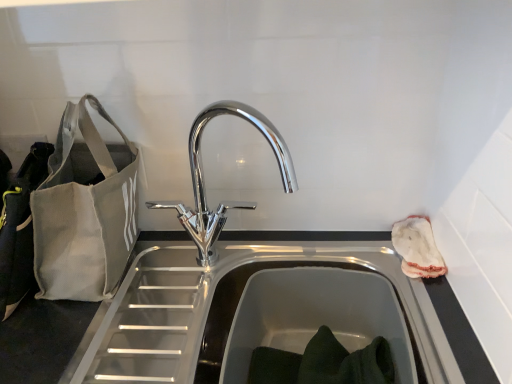
Question: Is chrome metallic faucet at center aimed at white fabric pouch at right?

Choices:
 (A) no
 (B) yes

Answer: (A)

Question: Is chrome metallic faucet at center thinner than white fabric pouch at right?

Choices:
 (A) yes
 (B) no

Answer: (B)

Question: Is chrome metallic faucet at center not near white fabric pouch at right?

Choices:
 (A) no
 (B) yes

Answer: (A)

Question: Is chrome metallic faucet at center to the right of white fabric pouch at right from the viewer's perspective?

Choices:
 (A) no
 (B) yes

Answer: (A)

Question: Is the surface of chrome metallic faucet at center in direct contact with white fabric pouch at right?

Choices:
 (A) yes
 (B) no

Answer: (B)

Question: From the image's perspective, is gray canvas bag at left positioned above or below chrome metallic faucet at center?

Choices:
 (A) below
 (B) above

Answer: (B)

Question: In the image, is gray canvas bag at left positioned in front of or behind chrome metallic faucet at center?

Choices:
 (A) front
 (B) behind

Answer: (A)

Question: In terms of width, does gray canvas bag at left look wider or thinner when compared to chrome metallic faucet at center?

Choices:
 (A) wide
 (B) thin

Answer: (A)

Question: Is gray canvas bag at left bigger or smaller than chrome metallic faucet at center?

Choices:
 (A) big
 (B) small

Answer: (A)

Question: Is point (437, 276) positioned closer to the camera than point (104, 246)?

Choices:
 (A) closer
 (B) farther

Answer: (B)

Question: Do you think white fabric pouch at right is within gray canvas bag at left, or outside of it?

Choices:
 (A) outside
 (B) inside

Answer: (A)

Question: From a real-world perspective, is white fabric pouch at right positioned above or below gray canvas bag at left?

Choices:
 (A) above
 (B) below

Answer: (B)

Question: Is white fabric pouch at right wider or thinner than gray canvas bag at left?

Choices:
 (A) thin
 (B) wide

Answer: (A)

Question: From a real-world perspective, is chrome metallic faucet at center positioned above or below gray canvas bag at left?

Choices:
 (A) below
 (B) above

Answer: (A)

Question: Is point (252, 114) positioned closer to the camera than point (98, 180)?

Choices:
 (A) closer
 (B) farther

Answer: (B)